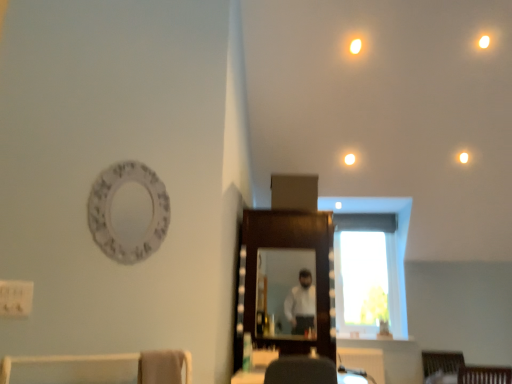
Question: Relative to white glossy light at upper center, is matte wooden mirror at center, the second mirror viewed from the front, in front or behind?

Choices:
 (A) front
 (B) behind

Answer: (A)

Question: Considering the positions of point (279, 332) and point (347, 153), is point (279, 332) closer or farther from the camera than point (347, 153)?

Choices:
 (A) closer
 (B) farther

Answer: (A)

Question: Which of these objects is positioned farthest from the white textured plate at upper left?

Choices:
 (A) white glossy light at upper center
 (B) warm matte light bulb at upper right, which appears as the first lighting when viewed from the back
 (C) matte wooden mirror at center, the second mirror viewed from the front
 (D) white glossy light at upper center, the second lighting when ordered from back to front
 (E) transparent glass window at center

Answer: (E)

Question: Estimate the real-world distances between objects in this image. Which object is closer to the white glossy light at upper center, the second lighting when ordered from back to front?

Choices:
 (A) white glossy light at upper center
 (B) matte wooden mirror at center, the second mirror viewed from the front
 (C) white textured plate at upper left
 (D) wooden mirror at center, the 2th mirror positioned from the back
 (E) warm matte light bulb at upper right, positioned as the 2th lighting in top-to-bottom order

Answer: (A)